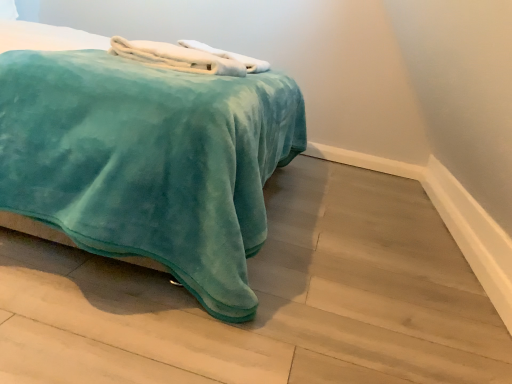
Question: Does white soft towel at upper center, the 2th bath towel when ordered from back to front, have a greater height compared to teal velvety bed at center?

Choices:
 (A) no
 (B) yes

Answer: (A)

Question: From the image's perspective, does white soft towel at upper center, the 2th bath towel when ordered from back to front, appear lower than teal velvety bed at center?

Choices:
 (A) no
 (B) yes

Answer: (B)

Question: From the image's perspective, is white soft towel at upper center, the first bath towel in the front-to-back sequence, on teal velvety bed at center?

Choices:
 (A) no
 (B) yes

Answer: (A)

Question: From a real-world perspective, is white soft towel at upper center, the first bath towel in the front-to-back sequence, on teal velvety bed at center?

Choices:
 (A) yes
 (B) no

Answer: (A)

Question: Does white soft towel at upper center, the 2th bath towel when ordered from back to front, have a smaller size compared to teal velvety bed at center?

Choices:
 (A) yes
 (B) no

Answer: (A)

Question: Is white soft towel at upper center, the first bath towel in the front-to-back sequence, not inside teal velvety bed at center?

Choices:
 (A) no
 (B) yes

Answer: (A)

Question: Considering the relative sizes of white fluffy bath towel at upper center, the second bath towel when ordered from front to back, and teal velvety bed at center in the image provided, is white fluffy bath towel at upper center, the second bath towel when ordered from front to back, thinner than teal velvety bed at center?

Choices:
 (A) yes
 (B) no

Answer: (A)

Question: Does white fluffy bath towel at upper center, which is the first bath towel from back to front, have a lesser height compared to teal velvety bed at center?

Choices:
 (A) no
 (B) yes

Answer: (B)

Question: Could you tell me if white fluffy bath towel at upper center, the second bath towel when ordered from front to back, is facing teal velvety bed at center?

Choices:
 (A) yes
 (B) no

Answer: (A)

Question: Does white fluffy bath towel at upper center, which is the first bath towel from back to front, lie behind teal velvety bed at center?

Choices:
 (A) yes
 (B) no

Answer: (A)

Question: From a real-world perspective, is white fluffy bath towel at upper center, the second bath towel when ordered from front to back, below teal velvety bed at center?

Choices:
 (A) yes
 (B) no

Answer: (B)

Question: Is white fluffy bath towel at upper center, the second bath towel when ordered from front to back, with teal velvety bed at center?

Choices:
 (A) yes
 (B) no

Answer: (B)

Question: Is white fluffy bath towel at upper center, which is the first bath towel from back to front, at the back of teal velvety bed at center?

Choices:
 (A) yes
 (B) no

Answer: (B)